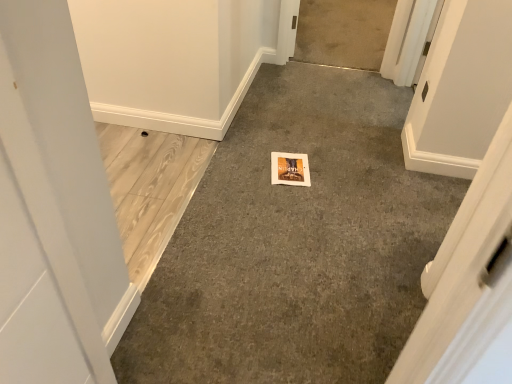
Question: In the image, is light brown wood flooring at left, the 2th concrete viewed from the front, positioned in front of or behind gray carpet at center, the third concrete positioned from the front?

Choices:
 (A) front
 (B) behind

Answer: (A)

Question: Would you say light brown wood flooring at left, the 2th concrete viewed from the front, is inside or outside gray carpet at center, the third concrete positioned from the front?

Choices:
 (A) outside
 (B) inside

Answer: (A)

Question: Which of these objects is positioned closest to the gray carpet at center, marked as the first concrete in a front-to-back arrangement?

Choices:
 (A) gray carpet at center, the third concrete positioned from the front
 (B) light brown wood flooring at left, which is the 2th concrete in back-to-front order

Answer: (B)

Question: Which is farther from the gray carpet at center, which is counted as the 1th concrete, starting from the back?

Choices:
 (A) gray carpet at center, which is counted as the third concrete, starting from the back
 (B) light brown wood flooring at left, which is the 2th concrete in back-to-front order

Answer: (B)